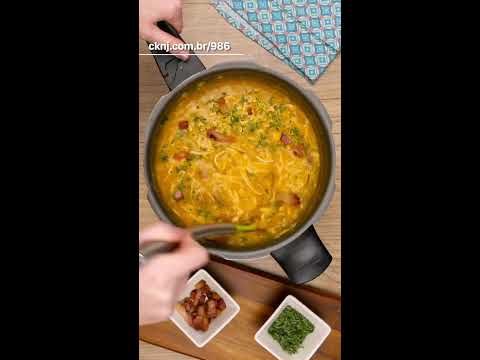
Where is `black pot handle`? black pot handle is located at coordinates (296, 249).